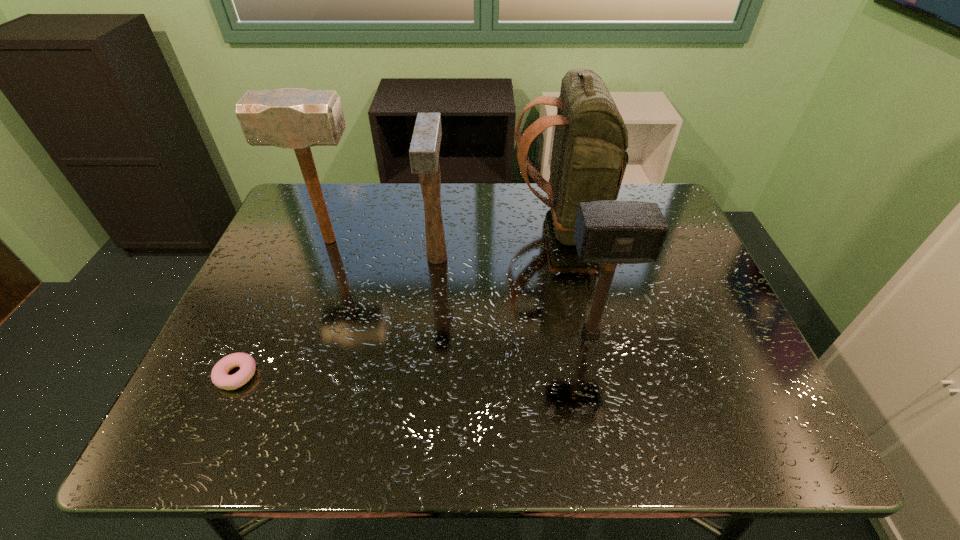
This screenshot has height=540, width=960. Identify the location of backpack. [589, 157].

Where is `the leftmost mallet`? the leftmost mallet is located at coordinates (290, 118).

In order to click on the second mallet from right to left in this screenshot , I will do `click(424, 149)`.

Where is `the rightmost mallet`? The height and width of the screenshot is (540, 960). the rightmost mallet is located at coordinates (609, 232).

Locate an element on the screen. the fourth farthest object is located at coordinates (609, 232).

At what (x,y) coordinates should I click in order to perform the action: click on doughnut. Please return your answer as a coordinate pair (x, y). The height and width of the screenshot is (540, 960). Looking at the image, I should click on (219, 375).

The height and width of the screenshot is (540, 960). Find the location of `the shortest object`. the shortest object is located at coordinates (219, 375).

This screenshot has height=540, width=960. Find the location of `vacant area located on the back of the backpack`. vacant area located on the back of the backpack is located at coordinates (490, 225).

The height and width of the screenshot is (540, 960). Find the location of `vacant position located on the back of the backpack`. vacant position located on the back of the backpack is located at coordinates (423, 225).

The width and height of the screenshot is (960, 540). What are the coordinates of `free location located on the back of the backpack` in the screenshot? It's located at pyautogui.click(x=385, y=225).